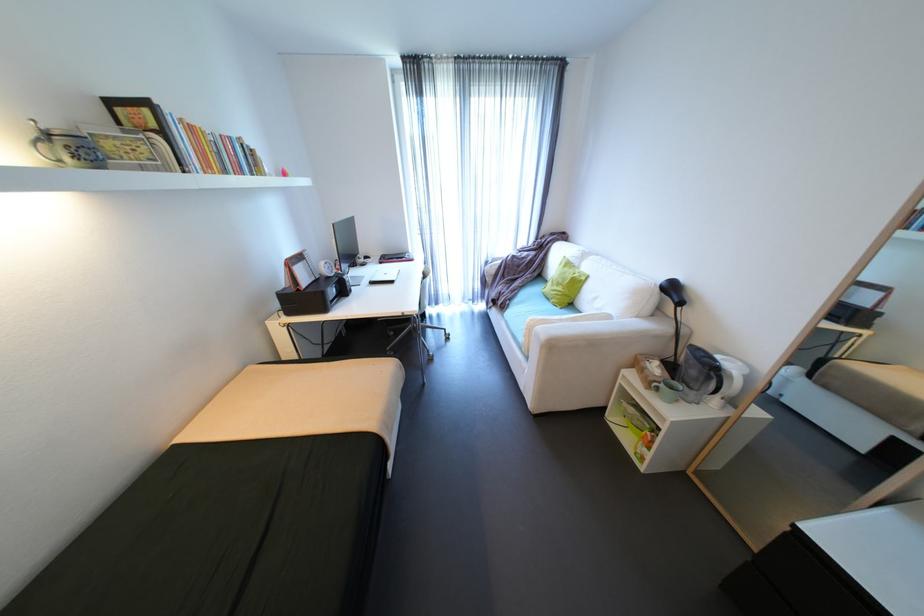
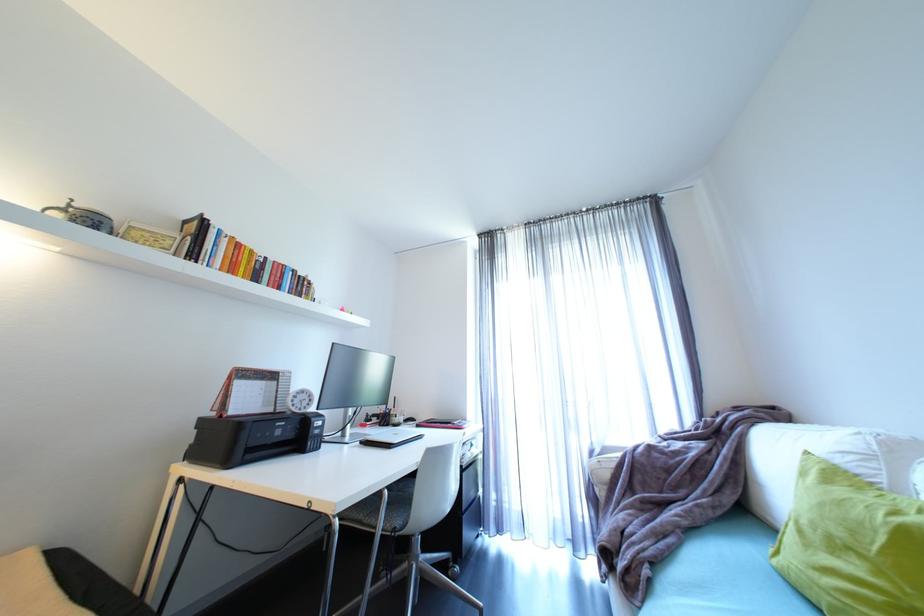
In the second image, find the point that corresponds to point (515, 302) in the first image.

(653, 572)